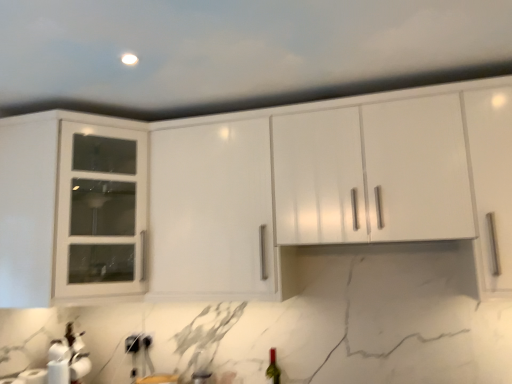
Question: From a real-world perspective, is white glass cabinet at upper left located beneath white matte paper towel at lower left?

Choices:
 (A) no
 (B) yes

Answer: (A)

Question: Considering the relative sizes of white glass cabinet at upper left and white matte paper towel at lower left in the image provided, is white glass cabinet at upper left smaller than white matte paper towel at lower left?

Choices:
 (A) yes
 (B) no

Answer: (B)

Question: Is white glass cabinet at upper left far from white matte paper towel at lower left?

Choices:
 (A) no
 (B) yes

Answer: (A)

Question: Is white glass cabinet at upper left facing away from white matte paper towel at lower left?

Choices:
 (A) yes
 (B) no

Answer: (B)

Question: Can you confirm if white glass cabinet at upper left is positioned to the right of white matte paper towel at lower left?

Choices:
 (A) yes
 (B) no

Answer: (A)

Question: Is white glass cabinet at upper left inside or outside of white matte paper towel at lower left?

Choices:
 (A) inside
 (B) outside

Answer: (B)

Question: Is point (59, 269) closer or farther from the camera than point (40, 382)?

Choices:
 (A) farther
 (B) closer

Answer: (B)

Question: From their relative heights in the image, would you say white glass cabinet at upper left is taller or shorter than white matte paper towel at lower left?

Choices:
 (A) short
 (B) tall

Answer: (B)

Question: Is white glass cabinet at upper left in front of or behind white matte paper towel at lower left in the image?

Choices:
 (A) behind
 (B) front

Answer: (B)

Question: Considering the relative positions of white matte paper towel at lower left and white glass cabinet at upper left in the image provided, is white matte paper towel at lower left to the left or to the right of white glass cabinet at upper left?

Choices:
 (A) right
 (B) left

Answer: (B)

Question: Considering the positions of white matte paper towel at lower left and white glass cabinet at upper left in the image, is white matte paper towel at lower left bigger or smaller than white glass cabinet at upper left?

Choices:
 (A) big
 (B) small

Answer: (B)

Question: Is point (29, 375) positioned closer to the camera than point (103, 236)?

Choices:
 (A) closer
 (B) farther

Answer: (A)

Question: From the image's perspective, is white matte paper towel at lower left positioned above or below white glass cabinet at upper left?

Choices:
 (A) below
 (B) above

Answer: (A)

Question: Do you think green glass wine bottle at lower center is within white glass cabinet at upper left, or outside of it?

Choices:
 (A) inside
 (B) outside

Answer: (B)

Question: Visually, is green glass wine bottle at lower center positioned to the left or to the right of white glass cabinet at upper left?

Choices:
 (A) left
 (B) right

Answer: (B)